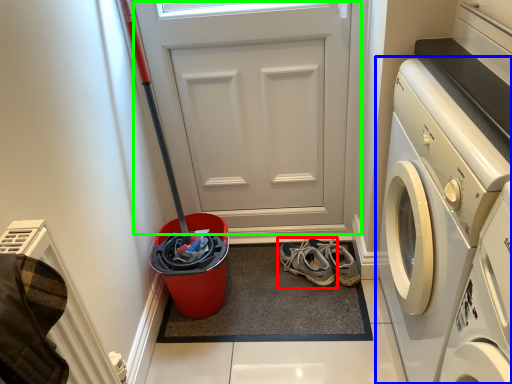
Question: Estimate the real-world distances between objects in this image. Which object is farther from footwear (highlighted by a red box), washing machine (highlighted by a blue box) or door (highlighted by a green box)?

Choices:
 (A) washing machine
 (B) door

Answer: (A)